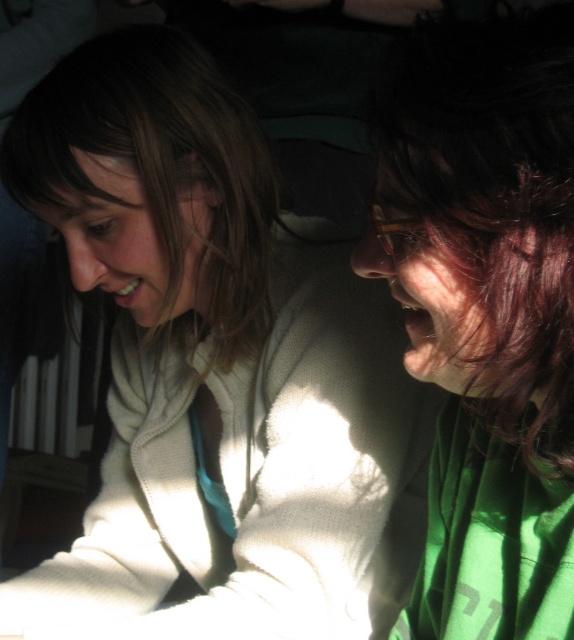
Question: Does white fuzzy sweater at center appear on the left side of shiny brown hair at right?

Choices:
 (A) no
 (B) yes

Answer: (B)

Question: Which object is closer to the camera taking this photo?

Choices:
 (A) white fuzzy sweater at center
 (B) shiny brown hair at right

Answer: (B)

Question: In this image, where is white fuzzy sweater at center located relative to shiny brown hair at right?

Choices:
 (A) right
 (B) left

Answer: (B)

Question: Is white fuzzy sweater at center above shiny brown hair at right?

Choices:
 (A) yes
 (B) no

Answer: (B)